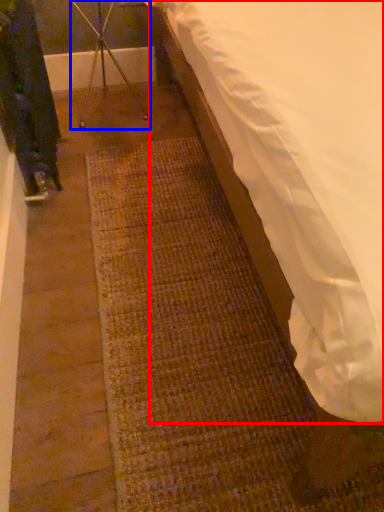
Question: Which of the following is the closest to the observer, mattress (highlighted by a red box) or tripod (highlighted by a blue box)?

Choices:
 (A) mattress
 (B) tripod

Answer: (A)